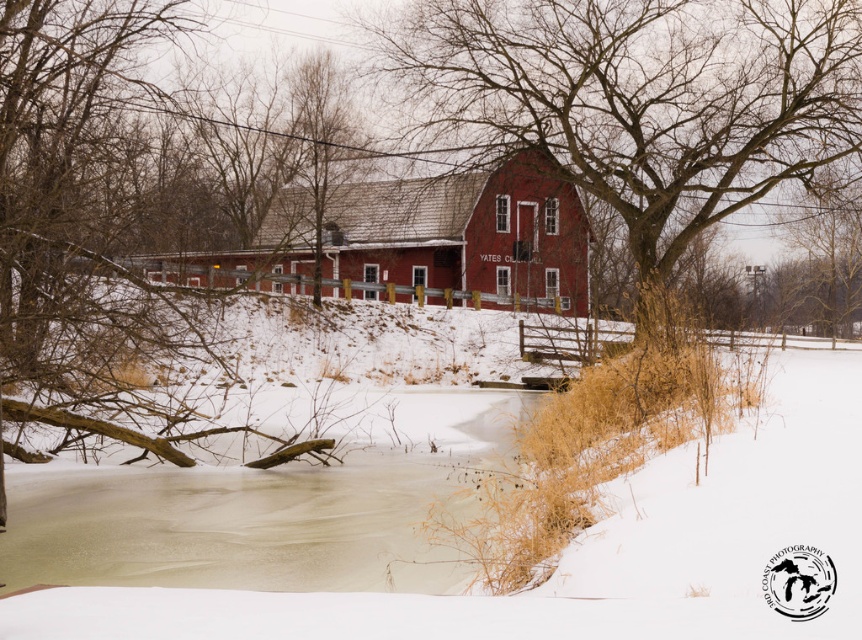
Does bare branches at center have a lesser width compared to matte red barn at center?

No, bare branches at center is not thinner than matte red barn at center.

Is bare branches at center positioned behind matte red barn at center?

Yes, it is.

Identify the location of bare branches at center. This screenshot has width=862, height=640. (639, 97).

Image resolution: width=862 pixels, height=640 pixels. In order to click on bare branches at center in this screenshot , I will do `click(639, 97)`.

Does point (211, 202) lie behind point (507, 275)?

No, (211, 202) is closer to viewer.

Consider the image. How much distance is there between bare branches at left and matte red barn at center?

The distance of bare branches at left from matte red barn at center is 6.43 meters.

Is point (238, 200) less distant than point (498, 269)?

No.

Locate an element on the screen. Image resolution: width=862 pixels, height=640 pixels. bare branches at left is located at coordinates (111, 195).

Which is behind, point (540, 10) or point (19, 76)?

The point (540, 10) is behind.

Who is lower down, bare branches at center or bare branches at left?

bare branches at left

Who is more forward, (628, 10) or (220, 157)?

Point (628, 10) is more forward.

This screenshot has width=862, height=640. In order to click on bare branches at center in this screenshot , I will do `click(639, 97)`.